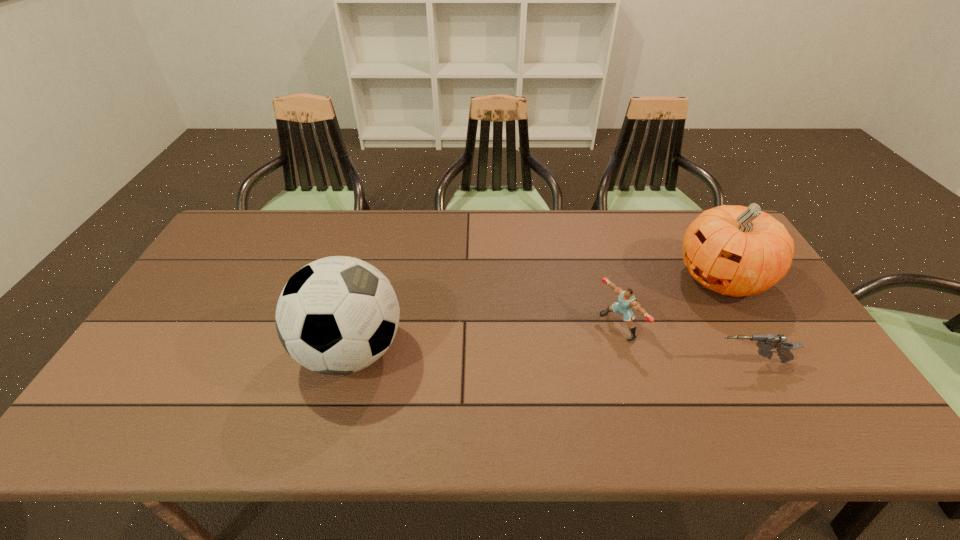
You are a GUI agent. You are given a task and a screenshot of the screen. Output one action in this format:
    pyautogui.click(x=<x>, y=<y>)
    Task: Click on the free space in the image that satisfies the following two spatial constraints: 1. on the front side of the second object from left to right; 2. at the barrel of the gun
    The width and height of the screenshot is (960, 540).
    Given the screenshot: What is the action you would take?
    pyautogui.click(x=629, y=362)